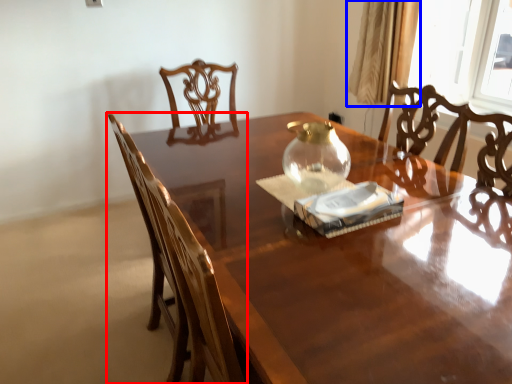
Question: Among these objects, which one is farthest to the camera, chair (highlighted by a red box) or curtain (highlighted by a blue box)?

Choices:
 (A) chair
 (B) curtain

Answer: (B)